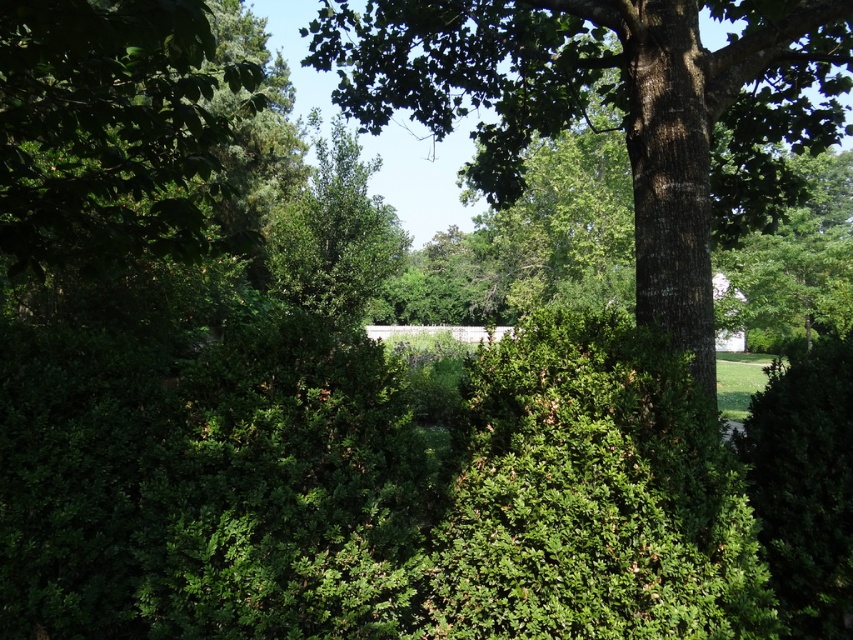
You are standing in the outdoor area and want to see the green leafy tree at left. Is it possible to see it without moving your position, considering the green rough bark tree at center?

The green leafy tree at left is behind the green rough bark tree at center, so it might be partially or fully blocked from view. You may need to move to get a clear view.

You are standing in the middle of the outdoor scene and want to walk towards both points. Which point, point (485,182) or point (102,1), will you reach first?

You will reach point (102,1) first because it is closer to you than point (485,182), which is further away.